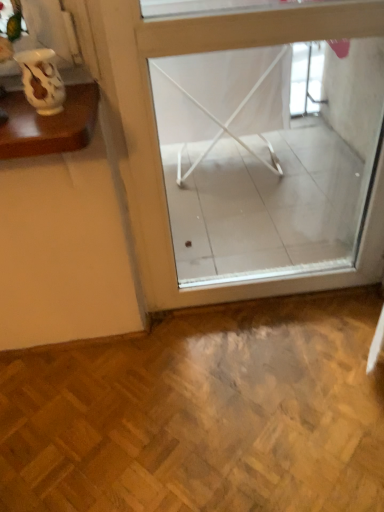
Question: Is matte white vase at upper left facing towards transparent glass window at center?

Choices:
 (A) no
 (B) yes

Answer: (A)

Question: From a real-world perspective, is matte white vase at upper left over transparent glass window at center?

Choices:
 (A) yes
 (B) no

Answer: (A)

Question: Considering the relative positions of matte white vase at upper left and transparent glass window at center in the image provided, is matte white vase at upper left to the right of transparent glass window at center from the viewer's perspective?

Choices:
 (A) yes
 (B) no

Answer: (B)

Question: Is matte white vase at upper left wider than transparent glass window at center?

Choices:
 (A) no
 (B) yes

Answer: (A)

Question: From a real-world perspective, is matte white vase at upper left under transparent glass window at center?

Choices:
 (A) yes
 (B) no

Answer: (B)

Question: Is matte white vase at upper left directly adjacent to transparent glass window at center?

Choices:
 (A) yes
 (B) no

Answer: (B)

Question: Can matte white vase at upper left be found inside transparent glass window at center?

Choices:
 (A) yes
 (B) no

Answer: (B)

Question: Is transparent glass window at center thinner than matte white vase at upper left?

Choices:
 (A) no
 (B) yes

Answer: (A)

Question: Can you see transparent glass window at center touching matte white vase at upper left?

Choices:
 (A) no
 (B) yes

Answer: (A)

Question: Can you confirm if transparent glass window at center is smaller than matte white vase at upper left?

Choices:
 (A) no
 (B) yes

Answer: (A)

Question: Is transparent glass window at center aimed at matte white vase at upper left?

Choices:
 (A) yes
 (B) no

Answer: (B)

Question: Considering the relative sizes of transparent glass window at center and matte white vase at upper left in the image provided, is transparent glass window at center wider than matte white vase at upper left?

Choices:
 (A) no
 (B) yes

Answer: (B)

Question: Is matte white vase at upper left bigger or smaller than transparent glass window at center?

Choices:
 (A) big
 (B) small

Answer: (B)